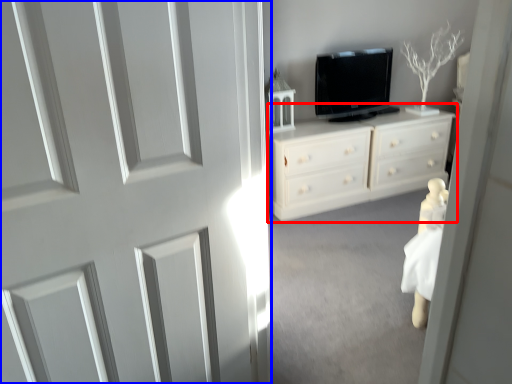
Question: Which object is closer to the camera taking this photo, chest of drawers (highlighted by a red box) or door (highlighted by a blue box)?

Choices:
 (A) chest of drawers
 (B) door

Answer: (B)